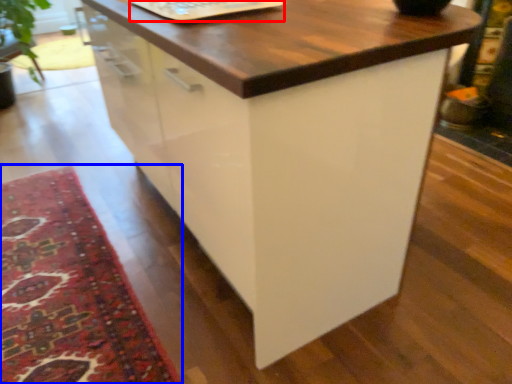
Question: Which object is further to the camera taking this photo, laptop keyboard (highlighted by a red box) or mat (highlighted by a blue box)?

Choices:
 (A) laptop keyboard
 (B) mat

Answer: (A)